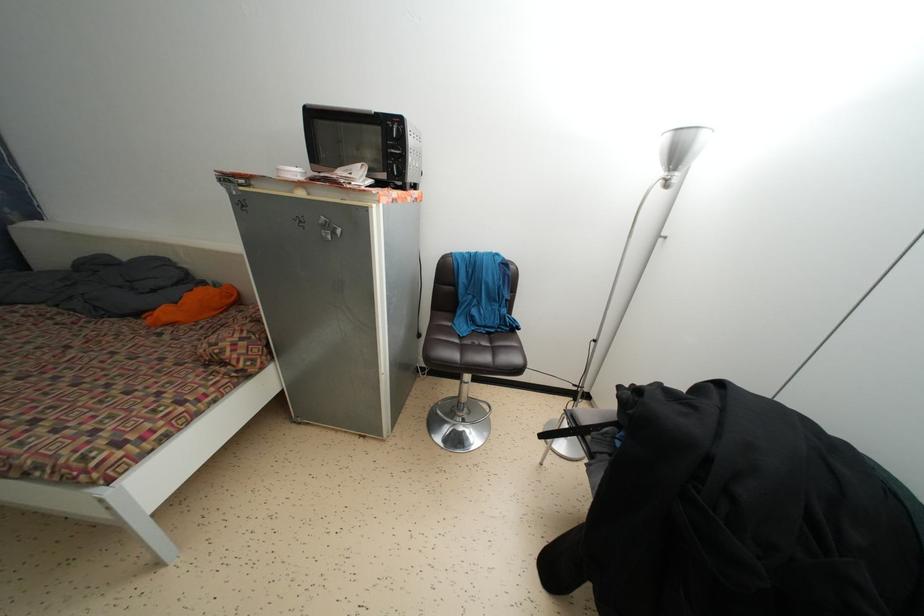
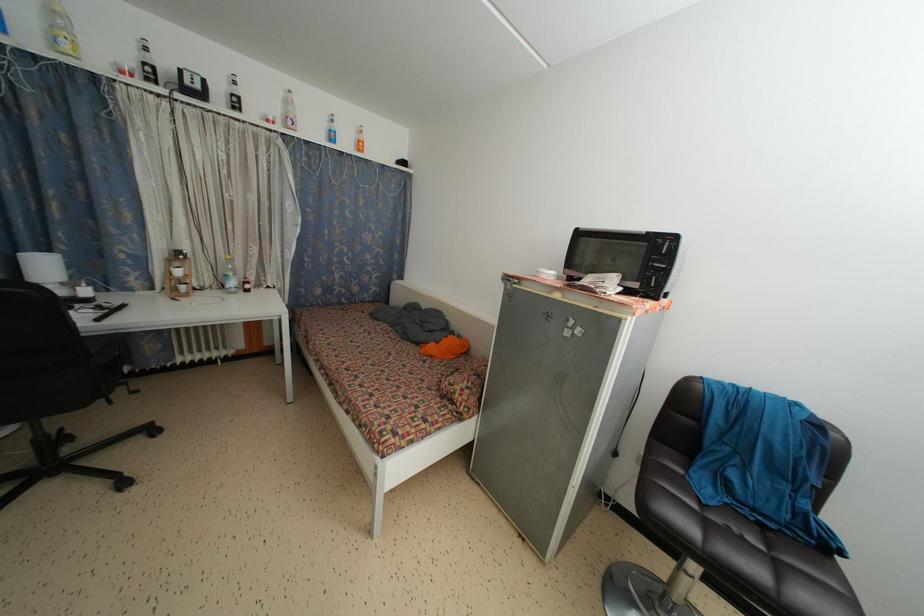
Question: The images are taken continuously from a first-person perspective. In which direction is your viewpoint rotating?

Choices:
 (A) Left
 (B) Right
 (C) Up
 (D) Down

Answer: (A)